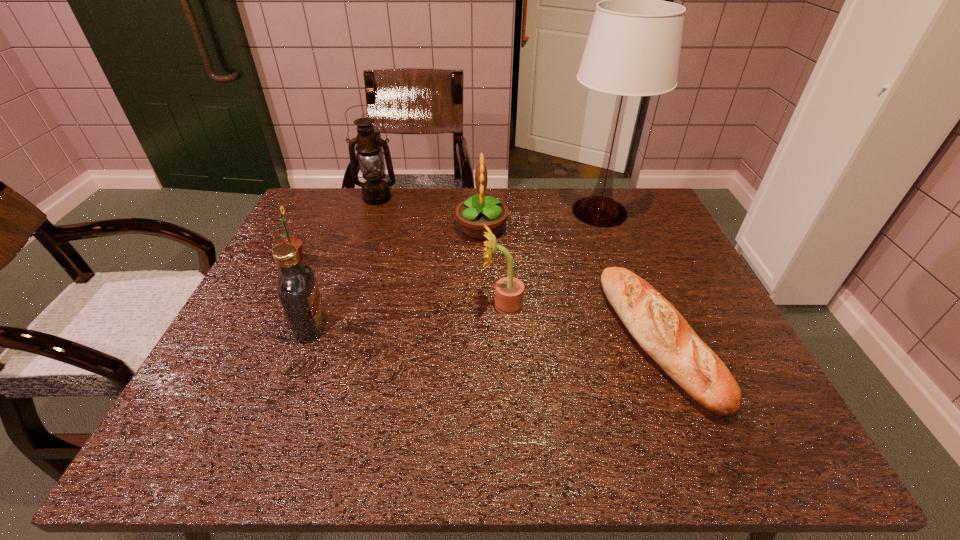
Identify which sunflower is located as the second nearest to the fourth farthest object. Please provide its 2D coordinates. Your answer should be formatted as a tuple, i.e. [(x, y)], where the tuple contains the x and y coordinates of a point satisfying the conditions above.

[(509, 291)]

You are a GUI agent. You are given a task and a screenshot of the screen. Output one action in this format:
    pyautogui.click(x=<x>, y=<y>)
    Task: Click on the vacant space that satisfies the following two spatial constraints: 1. on the back side of the baguet; 2. on the face of the shortest sunflower
    The width and height of the screenshot is (960, 540).
    Given the screenshot: What is the action you would take?
    pyautogui.click(x=626, y=258)

Find the location of `free space in the image that satisfies the following two spatial constraints: 1. on the front-facing side of the shortest object; 2. on the right side of the vodka`. free space in the image that satisfies the following two spatial constraints: 1. on the front-facing side of the shortest object; 2. on the right side of the vodka is located at coordinates [x=307, y=339].

Find the location of a particular element. free spot that satisfies the following two spatial constraints: 1. above the cylindrical shade of the table lamp; 2. on the face of the farthest sunflower is located at coordinates (605, 228).

Locate an element on the screen. The height and width of the screenshot is (540, 960). vacant point that satisfies the following two spatial constraints: 1. on the face of the shortest object; 2. on the left side of the nearest sunflower is located at coordinates (504, 339).

The image size is (960, 540). I want to click on free region that satisfies the following two spatial constraints: 1. above the cylindrical shade of the tallest object; 2. on the front-facing side of the vodka, so click(642, 327).